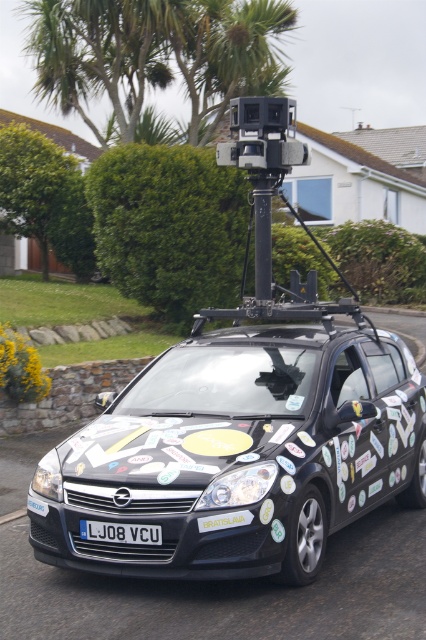
Question: Is black glossy car at center smaller than black plastic pole at center?

Choices:
 (A) yes
 (B) no

Answer: (B)

Question: Among these objects, which one is nearest to the camera?

Choices:
 (A) black plastic pole at center
 (B) black plastic license plate at center

Answer: (B)

Question: Among these objects, which one is farthest from the camera?

Choices:
 (A) black plastic license plate at center
 (B) black glossy car at center
 (C) black plastic pole at center

Answer: (C)

Question: Does black plastic pole at center have a smaller size compared to black plastic license plate at center?

Choices:
 (A) yes
 (B) no

Answer: (B)

Question: Which point is farther to the camera?

Choices:
 (A) (268, 186)
 (B) (129, 417)
 (C) (141, 529)

Answer: (A)

Question: Is black glossy car at center smaller than black plastic pole at center?

Choices:
 (A) yes
 (B) no

Answer: (B)